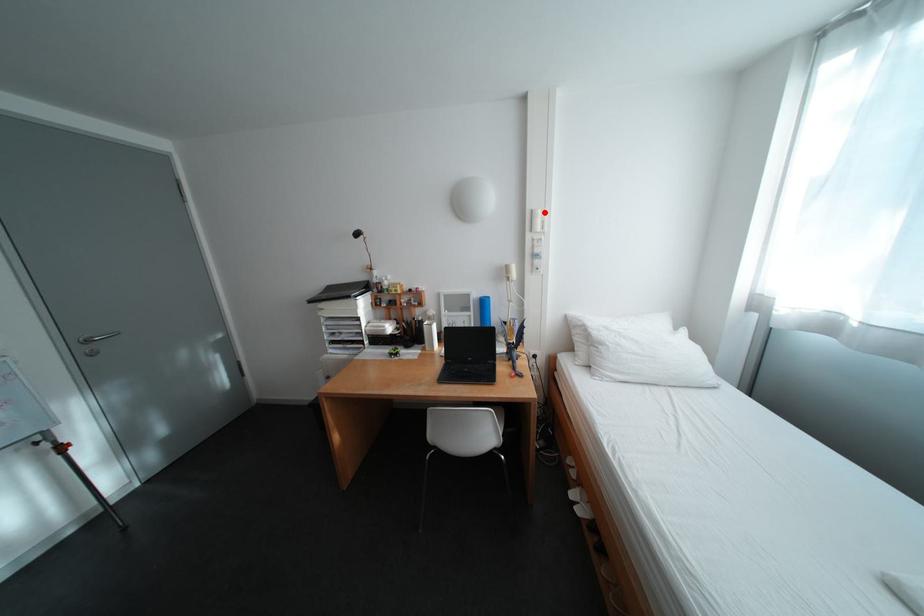
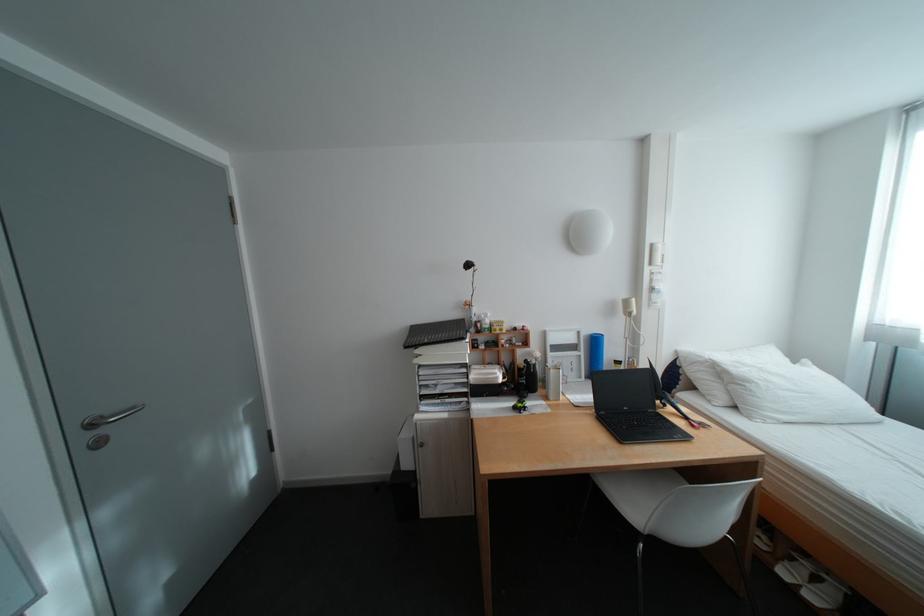
The point at the highlighted location is marked in the first image. Where is the corresponding point in the second image?

(664, 246)